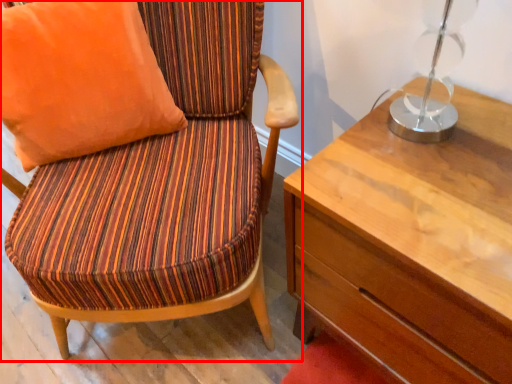
Question: From the image's perspective, what is the correct spatial positioning of chair (annotated by the red box) in reference to pillow?

Choices:
 (A) above
 (B) below

Answer: (B)